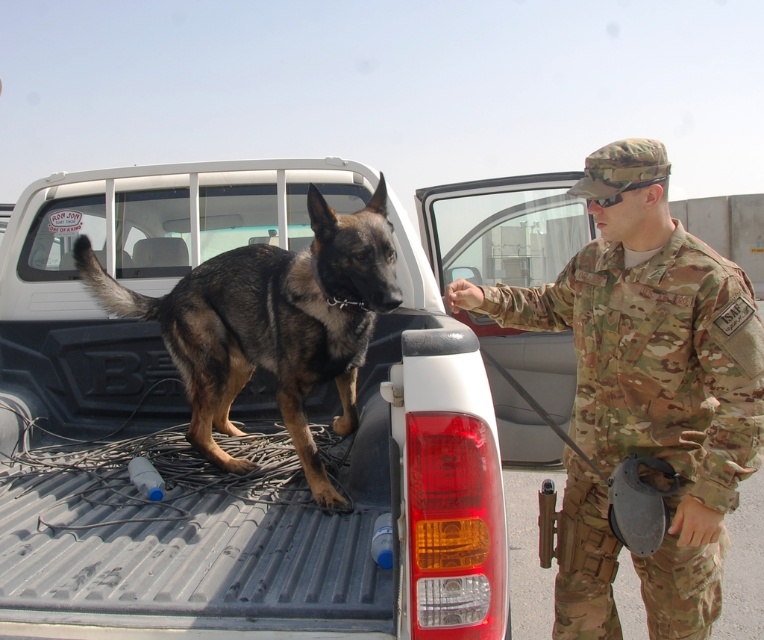
Can you confirm if camouflage uniform at center is bigger than brown fur dog at center?

No, camouflage uniform at center is not bigger than brown fur dog at center.

Between camouflage uniform at center and brown fur dog at center, which one has less height?

brown fur dog at center is shorter.

Which is behind, point (626, 358) or point (167, 321)?

The point (167, 321) is behind.

Where is `camouflage uniform at center`? camouflage uniform at center is located at coordinates (654, 368).